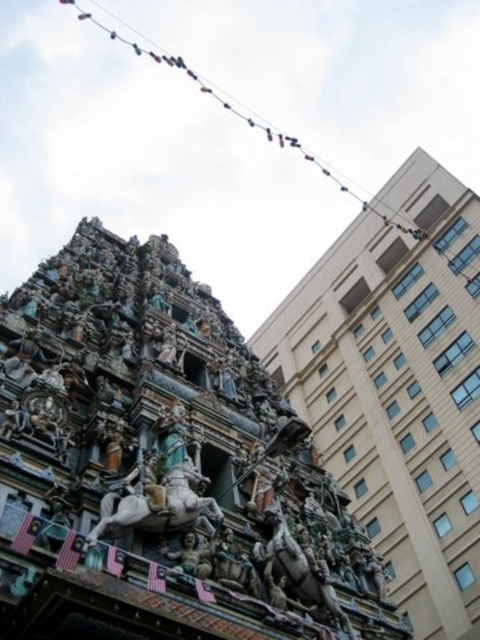
Question: Among these objects, which one is farthest from the camera?

Choices:
 (A) polished bronze horse at center
 (B) carved stone hindu temple at center

Answer: (B)

Question: Among these points, which one is farthest from the camera?

Choices:
 (A) (462, 376)
 (B) (166, 433)

Answer: (A)

Question: Does carved stone hindu temple at center appear on the right side of polished bronze horse at center?

Choices:
 (A) no
 (B) yes

Answer: (B)

Question: Which point appears farthest from the camera in this image?

Choices:
 (A) (345, 320)
 (B) (156, 448)

Answer: (A)

Question: Considering the relative positions of carved stone hindu temple at center and polished bronze horse at center in the image provided, where is carved stone hindu temple at center located with respect to polished bronze horse at center?

Choices:
 (A) below
 (B) above

Answer: (B)

Question: Does carved stone hindu temple at center have a lesser width compared to polished bronze horse at center?

Choices:
 (A) no
 (B) yes

Answer: (A)